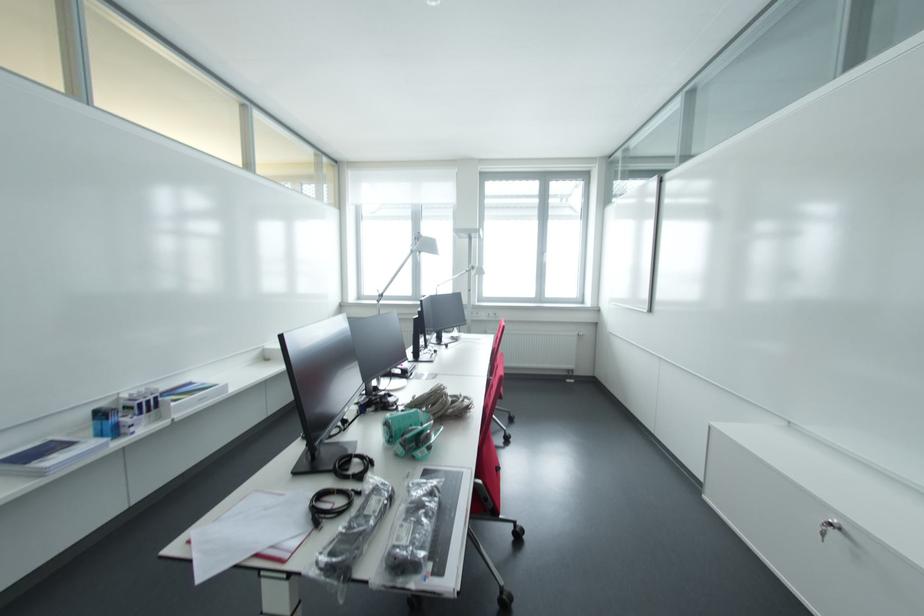
Where would you lift the turquoise object? Please return your answer as a coordinate pair (x, y).

(409, 432)